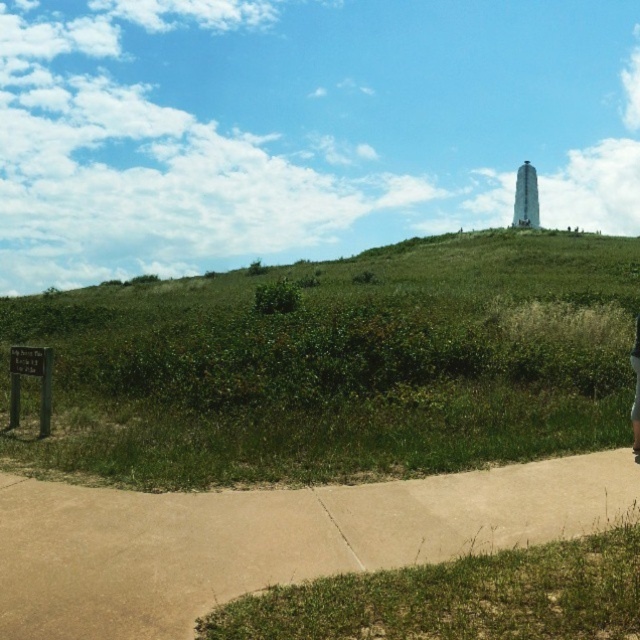
Based on the photo, is beige concrete sidewalk at lower center below skinny jeans at lower right?

Correct, beige concrete sidewalk at lower center is located below skinny jeans at lower right.

Is point (486, 529) closer to camera compared to point (636, 353)?

Yes, it is.

Is point (212, 579) closer to camera compared to point (637, 321)?

That is True.

I want to click on beige concrete sidewalk at lower center, so click(268, 538).

Between point (490, 250) and point (634, 417), which one is positioned behind?

Positioned behind is point (490, 250).

The image size is (640, 640). Find the location of `green grassy hill at upper center`. green grassy hill at upper center is located at coordinates (337, 365).

Locate an element on the screen. green grassy hill at upper center is located at coordinates (337, 365).

Find the location of `green grassy hill at upper center`. green grassy hill at upper center is located at coordinates (337, 365).

Is green grassy hill at upper center further to the viewer compared to beige concrete sidewalk at lower center?

Yes, it is behind beige concrete sidewalk at lower center.

Does green grassy hill at upper center have a greater height compared to beige concrete sidewalk at lower center?

Yes.

What do you see at coordinates (337, 365) in the screenshot?
I see `green grassy hill at upper center` at bounding box center [337, 365].

Locate an element on the screen. Image resolution: width=640 pixels, height=640 pixels. green grassy hill at upper center is located at coordinates (337, 365).